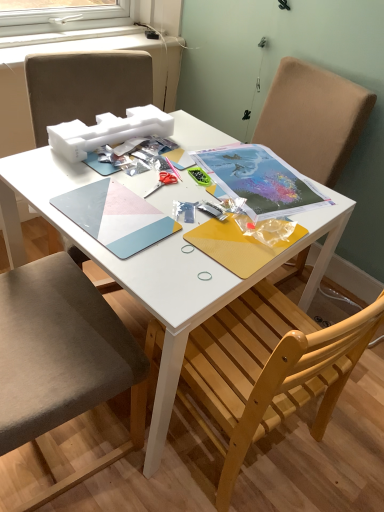
Image resolution: width=384 pixels, height=512 pixels. I want to click on vacant space to the left of matte plastic notebook at center, which ranks as the 1th notebook in left-to-right order, so click(44, 183).